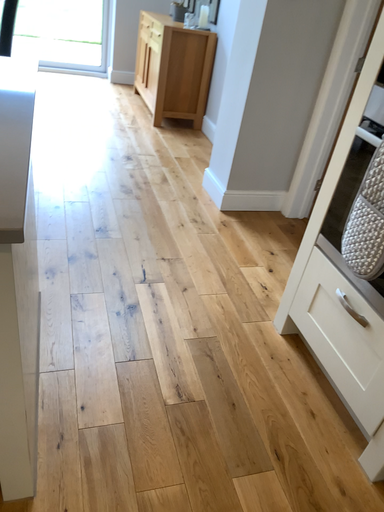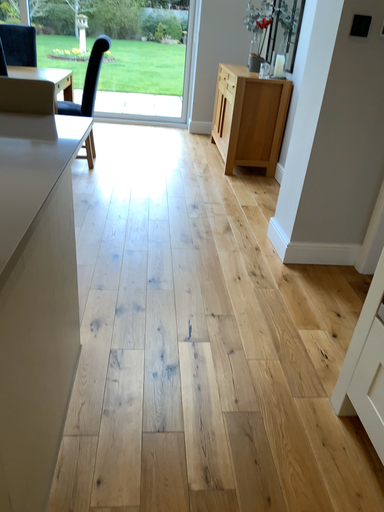
Question: Which way did the camera rotate in the video?

Choices:
 (A) rotated right
 (B) rotated left

Answer: (B)